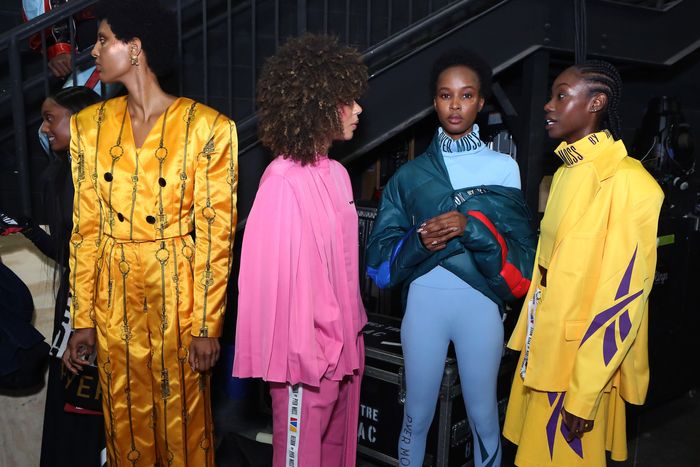
Locate an element on the screen. The height and width of the screenshot is (467, 700). stairway is located at coordinates (388, 55).